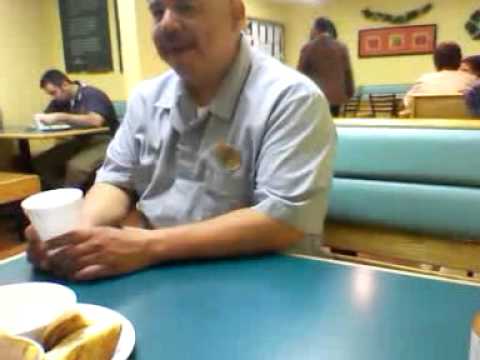
Where is `white cup`? Image resolution: width=480 pixels, height=360 pixels. white cup is located at coordinates (66, 214).